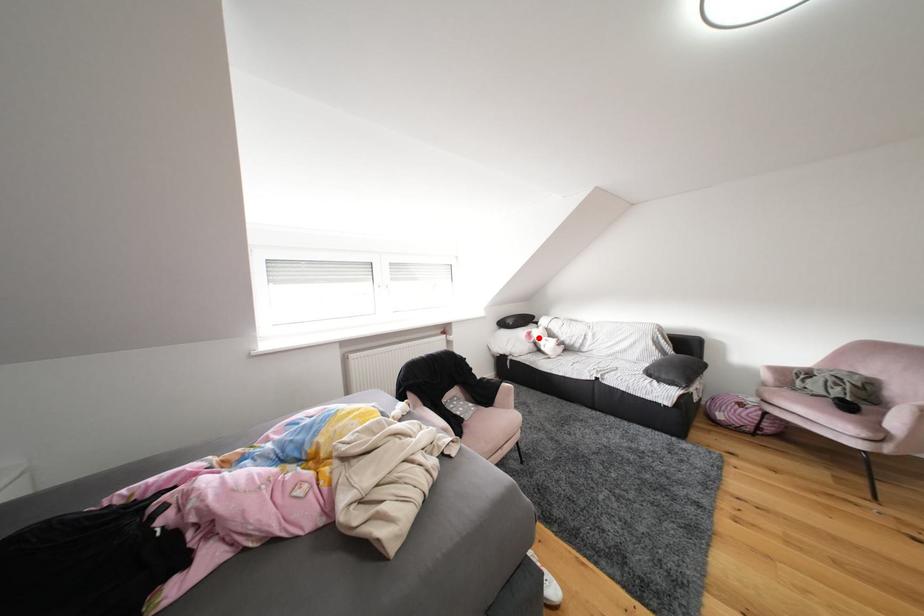
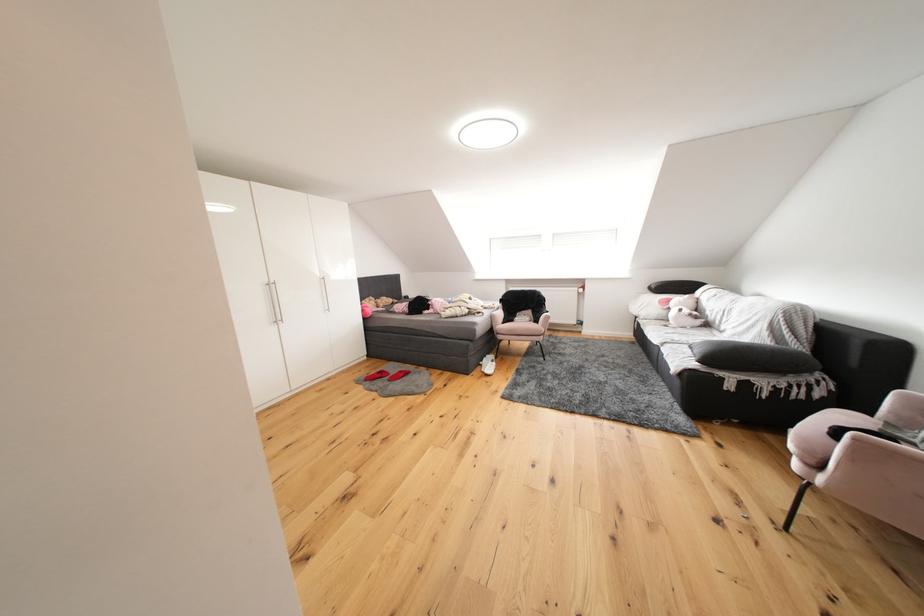
Find the pixel in the second image that matches the highlighted location in the first image.

(677, 305)